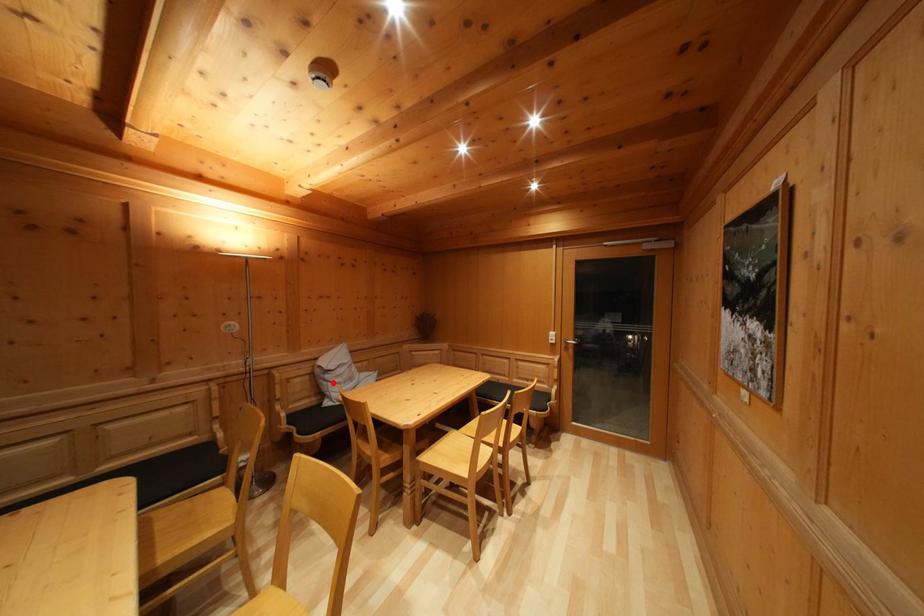
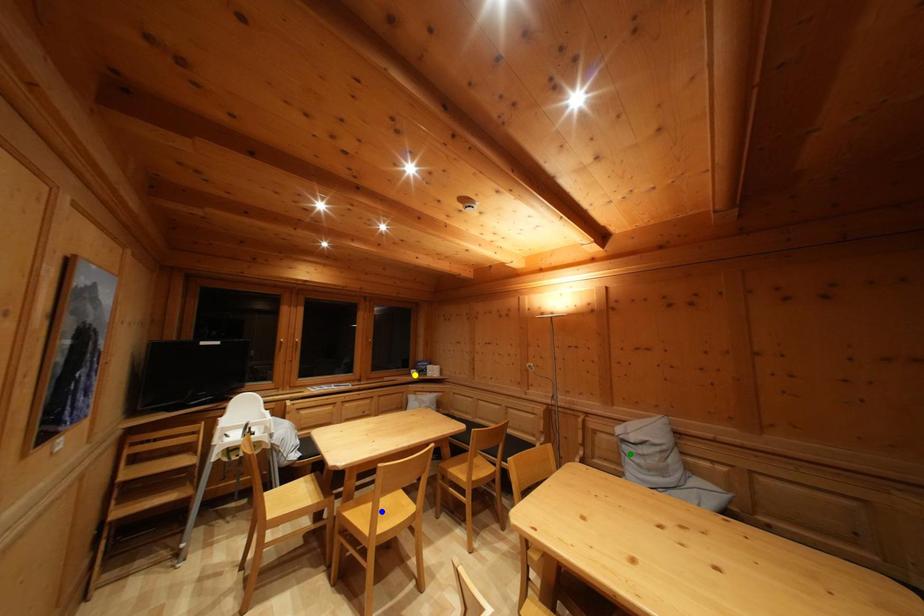
Question: I am providing you with two images of the same scene from different viewpoints. A red point is marked on the first image. You are given multiple points on the second image. Which spot in image 2 lines up with the point in image 1?

Choices:
 (A) green point
 (B) yellow point
 (C) blue point

Answer: (A)